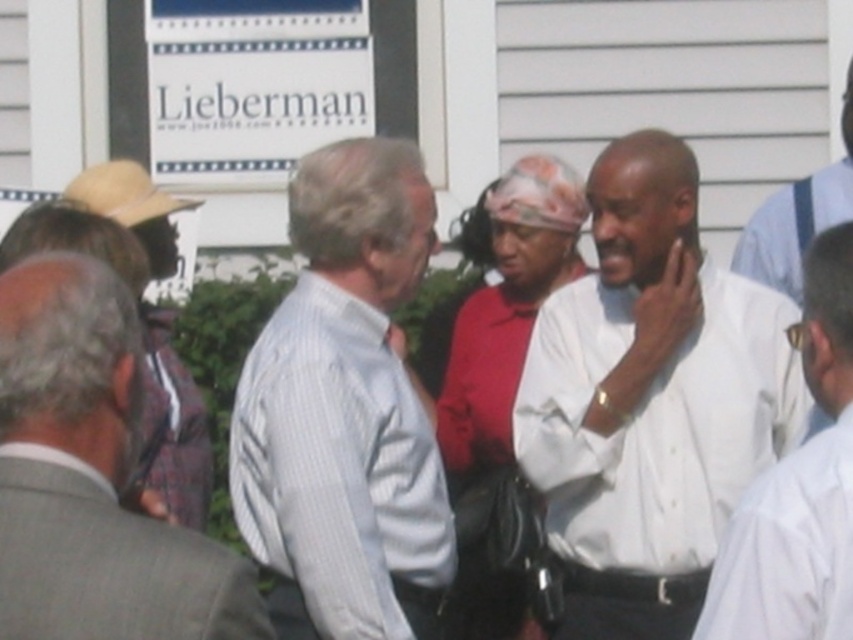
Question: Which point is farther to the camera?

Choices:
 (A) (837, 246)
 (B) (846, 125)

Answer: (B)

Question: Where is white shirt at center located in relation to white shirt at right in the image?

Choices:
 (A) right
 (B) left

Answer: (B)

Question: Is gray suit at left wider than white shirt at center?

Choices:
 (A) yes
 (B) no

Answer: (A)

Question: Does white cotton shirt at center have a greater width compared to white shirt at center?

Choices:
 (A) yes
 (B) no

Answer: (A)

Question: Which object is closer to the camera taking this photo?

Choices:
 (A) white shirt at right
 (B) light blue striped shirt at center
 (C) white shirt at center

Answer: (C)

Question: Among these points, which one is nearest to the camera?

Choices:
 (A) (579, 340)
 (B) (270, 451)
 (C) (732, 611)

Answer: (C)